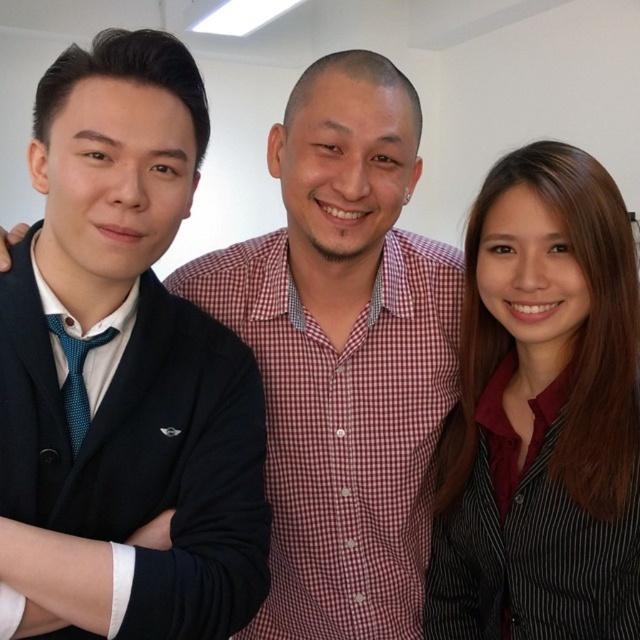
Is black striped shirt at right to the right of matte black blazer at left from the viewer's perspective?

Indeed, black striped shirt at right is positioned on the right side of matte black blazer at left.

Who is shorter, black striped shirt at right or matte black blazer at left?

matte black blazer at left

Between point (596, 428) and point (28, 234), which one is positioned behind?

Point (596, 428)

Locate an element on the screen. This screenshot has width=640, height=640. black striped shirt at right is located at coordinates (541, 413).